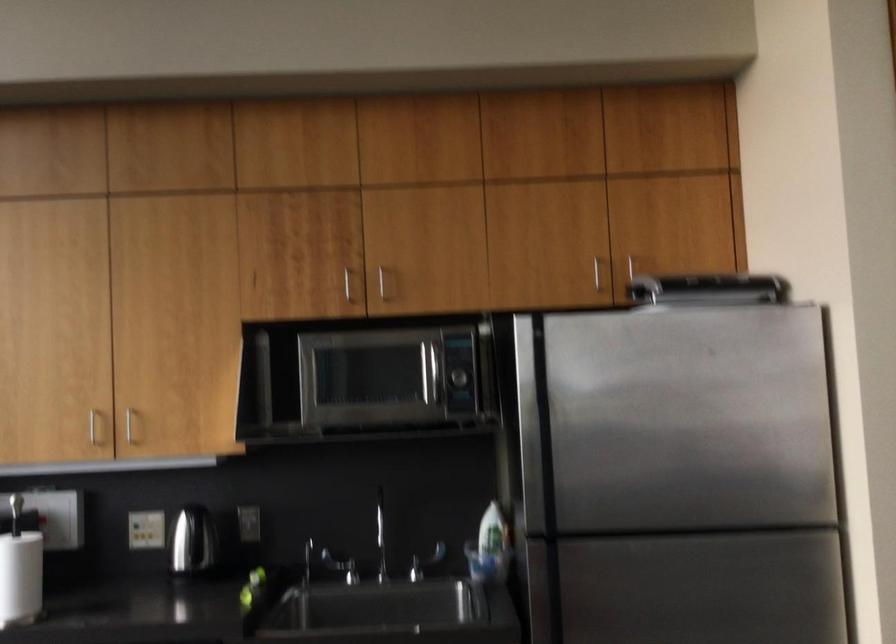
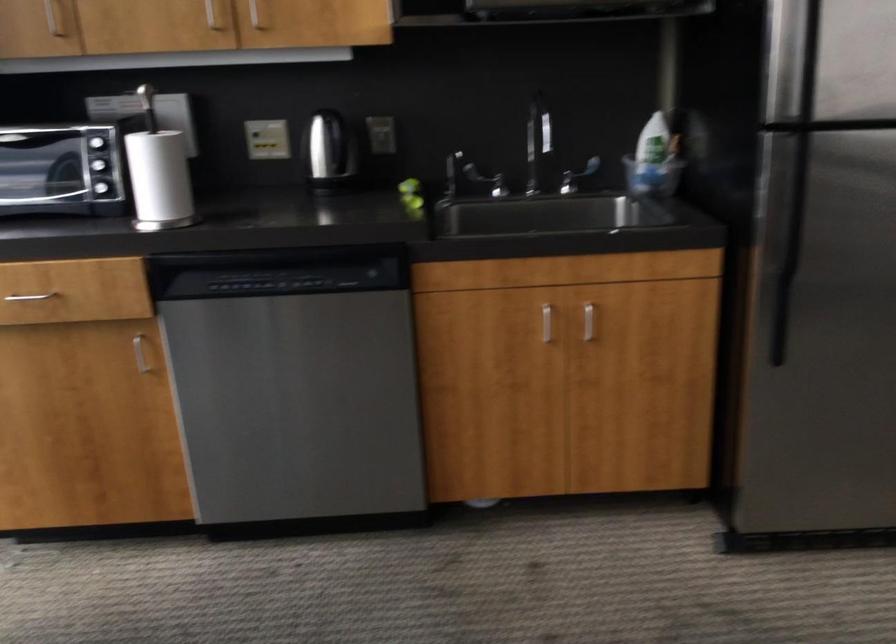
Where in the second image is the point corresponding to (424,558) from the first image?

(576, 176)